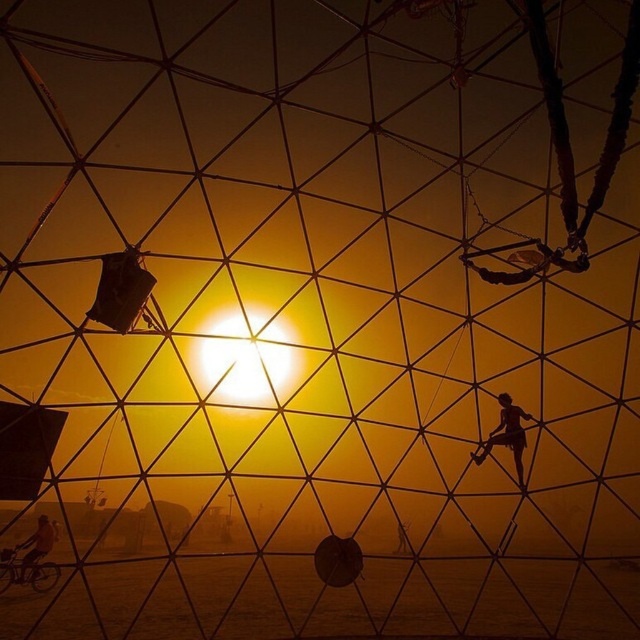
Question: Is matte black figure at center to the left of metallic bicycle at lower left from the viewer's perspective?

Choices:
 (A) yes
 (B) no

Answer: (B)

Question: Considering the relative positions of matte black figure at center and metallic bicycle at lower left in the image provided, where is matte black figure at center located with respect to metallic bicycle at lower left?

Choices:
 (A) above
 (B) below

Answer: (A)

Question: Among these objects, which one is farthest from the camera?

Choices:
 (A) matte black figure at center
 (B) metallic bicycle at lower left

Answer: (A)

Question: Which point is closer to the camera?

Choices:
 (A) (508, 406)
 (B) (48, 554)

Answer: (B)

Question: Which point is closer to the camera taking this photo?

Choices:
 (A) (508, 422)
 (B) (51, 536)

Answer: (B)

Question: Does matte black figure at center come in front of metallic bicycle at lower left?

Choices:
 (A) yes
 (B) no

Answer: (B)